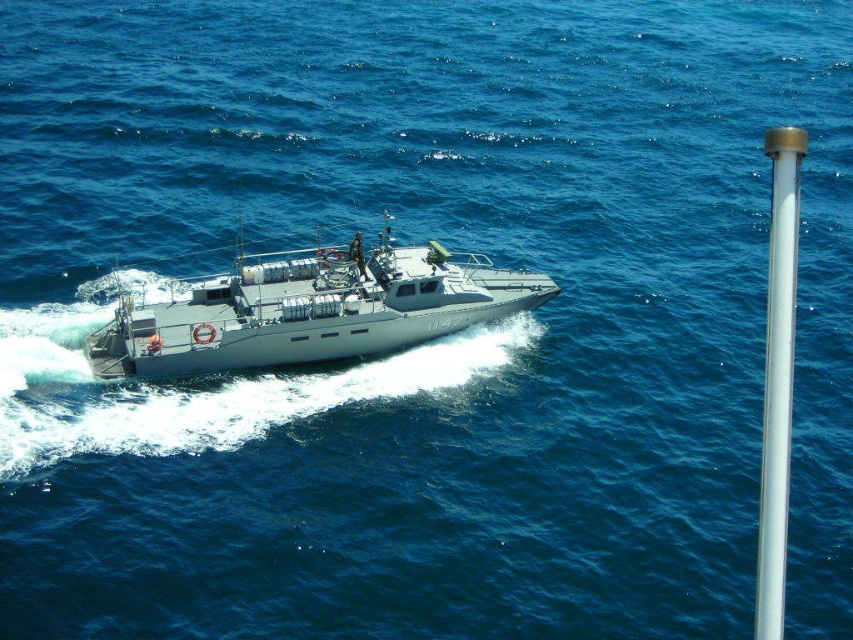
Which is more to the left, gray matte boat at center or white glossy pole at right?

gray matte boat at center is more to the left.

Does gray matte boat at center appear on the right side of white glossy pole at right?

No, gray matte boat at center is not to the right of white glossy pole at right.

Who is more forward, (279, 352) or (791, 173)?

Point (791, 173)

You are a GUI agent. You are given a task and a screenshot of the screen. Output one action in this format:
    pyautogui.click(x=<x>, y=<y>)
    Task: Click on the gray matte boat at center
    Image resolution: width=853 pixels, height=640 pixels.
    Given the screenshot: What is the action you would take?
    pyautogui.click(x=310, y=310)